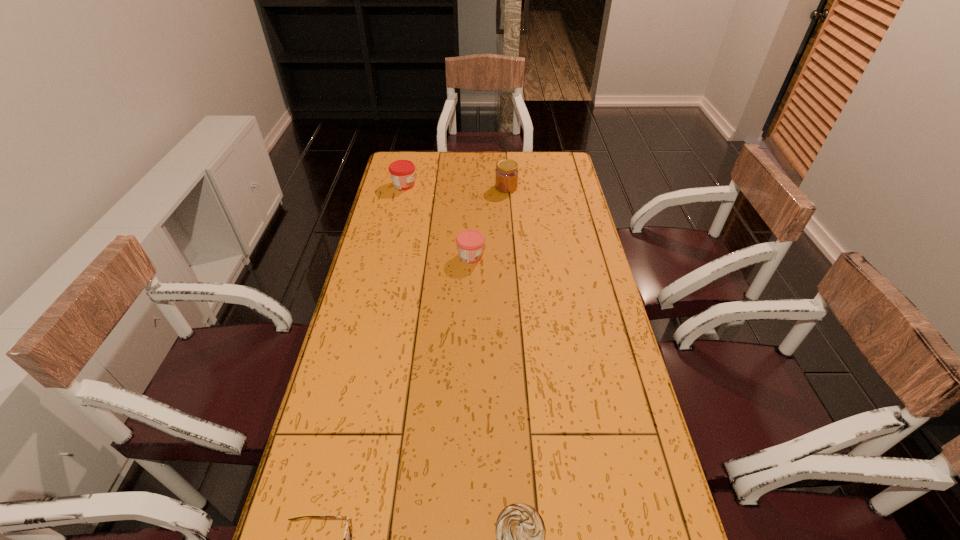
Identify which jam is located as the second nearest to the tallest object. Please provide its 2D coordinates. Your answer should be formatted as a tuple, i.e. [(x, y)], where the tuple contains the x and y coordinates of a point satisfying the conditions above.

[(470, 243)]

Where is `vacant space that satisfies the following two spatial constraints: 1. on the back side of the tallest jam; 2. on the label side of the leftmost jam`? vacant space that satisfies the following two spatial constraints: 1. on the back side of the tallest jam; 2. on the label side of the leftmost jam is located at coordinates (506, 185).

Locate an element on the screen. The image size is (960, 540). vacant point that satisfies the following two spatial constraints: 1. on the back side of the tallest jam; 2. on the label side of the leftmost jam is located at coordinates (506, 185).

In order to click on vacant region that satisfies the following two spatial constraints: 1. on the label side of the leftmost jam; 2. on the right side of the tallest jam in this screenshot , I will do `click(403, 187)`.